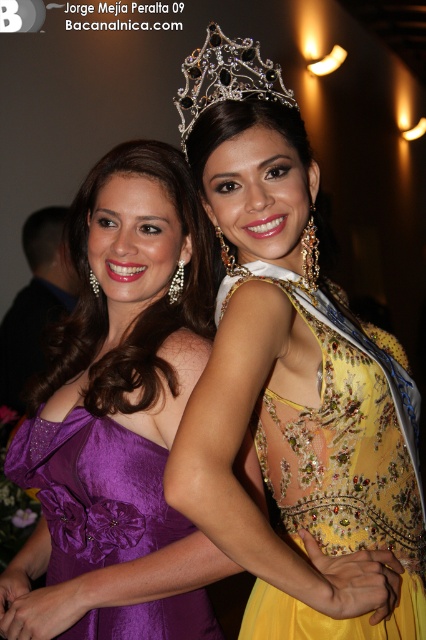
Question: Estimate the real-world distances between objects in this image. Which object is farther from the yellow beaded dress at center?

Choices:
 (A) diamond encrusted tiara at upper center
 (B) purple satin dress at left

Answer: (A)

Question: Does yellow beaded dress at center have a larger size compared to purple satin dress at left?

Choices:
 (A) no
 (B) yes

Answer: (B)

Question: Estimate the real-world distances between objects in this image. Which object is farther from the matte gold dress at center?

Choices:
 (A) purple satin dress at left
 (B) yellow beaded dress at center
 (C) purple satin dress at center
 (D) diamond encrusted tiara at upper center

Answer: (D)

Question: Is yellow beaded dress at center positioned behind purple satin dress at left?

Choices:
 (A) no
 (B) yes

Answer: (A)

Question: Is matte gold dress at center positioned before purple satin dress at left?

Choices:
 (A) yes
 (B) no

Answer: (A)

Question: Which of the following is the closest to the observer?

Choices:
 (A) (104, 538)
 (B) (345, 320)
 (C) (302, 547)
 (D) (210, 97)

Answer: (D)